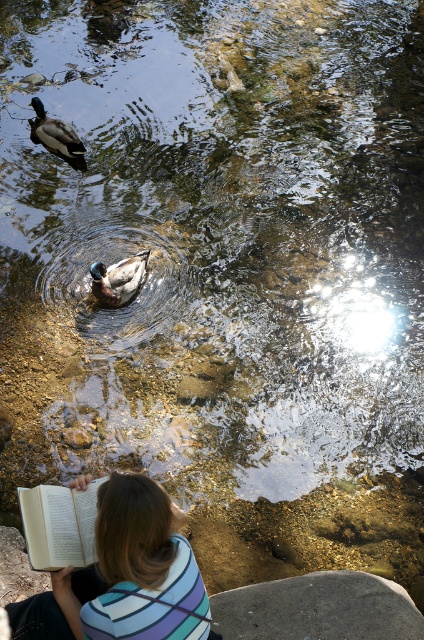
Is striped fabric shirt at lower center shorter than shiny brown duck at center?

No, striped fabric shirt at lower center is not shorter than shiny brown duck at center.

Is striped fabric shirt at lower center taller than shiny brown duck at center?

Indeed, striped fabric shirt at lower center has a greater height compared to shiny brown duck at center.

Is point (131, 561) farther from camera compared to point (145, 250)?

No, (131, 561) is closer to viewer.

This screenshot has width=424, height=640. In order to click on striped fabric shirt at lower center in this screenshot , I will do `click(123, 577)`.

Measure the distance between striped fabric shirt at lower center and white paper book at lower left.

A distance of 9.99 inches exists between striped fabric shirt at lower center and white paper book at lower left.

Between point (100, 625) and point (27, 522), which one is positioned behind?

Point (27, 522)

Find the location of a particular element. This screenshot has width=424, height=640. striped fabric shirt at lower center is located at coordinates (123, 577).

Does striped fabric shirt at lower center appear on the right side of green glossy duck at upper left?

Indeed, striped fabric shirt at lower center is positioned on the right side of green glossy duck at upper left.

You are a GUI agent. You are given a task and a screenshot of the screen. Output one action in this format:
    pyautogui.click(x=<x>, y=<y>)
    Task: Click on the striped fabric shirt at lower center
    This screenshot has height=640, width=424.
    Given the screenshot: What is the action you would take?
    pyautogui.click(x=123, y=577)

You are a GUI agent. You are given a task and a screenshot of the screen. Output one action in this format:
    pyautogui.click(x=<x>, y=<y>)
    Task: Click on the striped fabric shirt at lower center
    The image size is (424, 640).
    Given the screenshot: What is the action you would take?
    pyautogui.click(x=123, y=577)